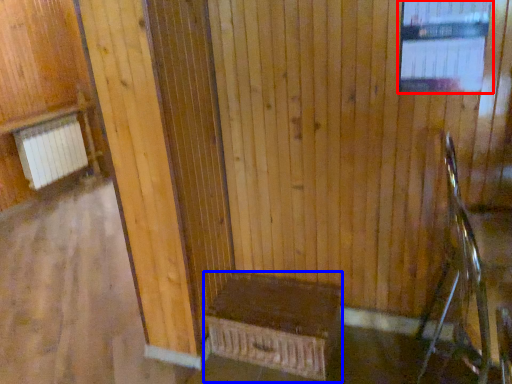
Question: Which object appears closest to the camera in this image, window (highlighted by a red box) or furniture (highlighted by a blue box)?

Choices:
 (A) window
 (B) furniture

Answer: (A)